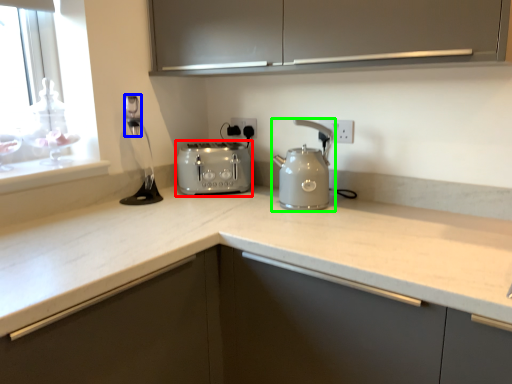
Question: Which object is the closest to the toaster (highlighted by a red box)? Choose among these: faucet (highlighted by a blue box) or kitchen appliance (highlighted by a green box).

Choices:
 (A) faucet
 (B) kitchen appliance

Answer: (B)